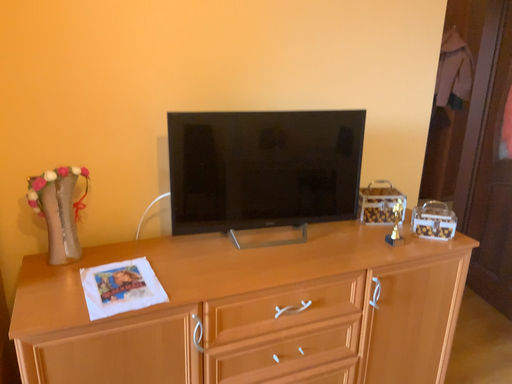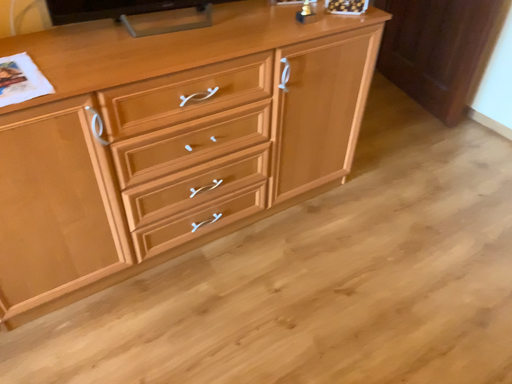
Question: Which way did the camera rotate in the video?

Choices:
 (A) rotated right
 (B) rotated left

Answer: (A)